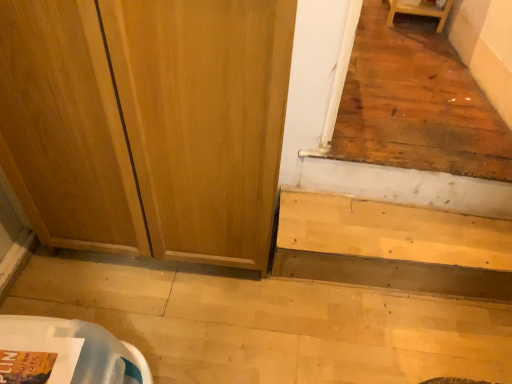
Describe the element at coordinates (392, 246) in the screenshot. I see `light wood/stained stairs at lower right` at that location.

Where is `light wood/stained stairs at lower right`? light wood/stained stairs at lower right is located at coordinates (392, 246).

The height and width of the screenshot is (384, 512). Describe the element at coordinates (204, 119) in the screenshot. I see `wooden screen door at center` at that location.

This screenshot has height=384, width=512. In order to click on wooden screen door at center in this screenshot , I will do `click(204, 119)`.

Image resolution: width=512 pixels, height=384 pixels. In order to click on light wood/stained stairs at lower right in this screenshot , I will do 392,246.

Considering the positions of objects wooden screen door at center and light wood/stained stairs at lower right in the image provided, who is more to the left, wooden screen door at center or light wood/stained stairs at lower right?

Positioned to the left is wooden screen door at center.

Considering the positions of objects wooden screen door at center and light wood/stained stairs at lower right in the image provided, who is in front, wooden screen door at center or light wood/stained stairs at lower right?

wooden screen door at center.

Is point (181, 8) positioned behind point (333, 202)?

No.

Consider the image. From the image's perspective, would you say wooden screen door at center is shown under light wood/stained stairs at lower right?

Incorrect, from the image's perspective, wooden screen door at center is higher than light wood/stained stairs at lower right.

From a real-world perspective, is wooden screen door at center above or below light wood/stained stairs at lower right?

In terms of real-world spatial position, wooden screen door at center is above light wood/stained stairs at lower right.

Consider the image. Is wooden screen door at center thinner than light wood/stained stairs at lower right?

In fact, wooden screen door at center might be wider than light wood/stained stairs at lower right.

In terms of height, does wooden screen door at center look taller or shorter compared to light wood/stained stairs at lower right?

wooden screen door at center is taller than light wood/stained stairs at lower right.

Considering the sizes of wooden screen door at center and light wood/stained stairs at lower right in the image, is wooden screen door at center bigger or smaller than light wood/stained stairs at lower right?

wooden screen door at center is bigger than light wood/stained stairs at lower right.

Is wooden screen door at center not within light wood/stained stairs at lower right?

Yes, wooden screen door at center is outside of light wood/stained stairs at lower right.

Is wooden screen door at center next to light wood/stained stairs at lower right and touching it?

No, wooden screen door at center is not in contact with light wood/stained stairs at lower right.

Is wooden screen door at center positioned with its back to light wood/stained stairs at lower right?

No, wooden screen door at center's orientation is not away from light wood/stained stairs at lower right.

Where is `screen door located on the left of light wood/stained stairs at lower right`? screen door located on the left of light wood/stained stairs at lower right is located at coordinates (204, 119).

Which is more to the left, light wood/stained stairs at lower right or wooden screen door at center?

wooden screen door at center is more to the left.

Considering the positions of objects light wood/stained stairs at lower right and wooden screen door at center in the image provided, who is behind, light wood/stained stairs at lower right or wooden screen door at center?

light wood/stained stairs at lower right is further away from the camera.

Is point (302, 247) closer or farther from the camera than point (202, 94)?

Point (302, 247) is positioned farther from the camera compared to point (202, 94).

From the image's perspective, is light wood/stained stairs at lower right located above or below wooden screen door at center?

light wood/stained stairs at lower right is below wooden screen door at center.

From a real-world perspective, is light wood/stained stairs at lower right below wooden screen door at center?

Indeed, from a real-world perspective, light wood/stained stairs at lower right is positioned beneath wooden screen door at center.

Is light wood/stained stairs at lower right wider or thinner than wooden screen door at center?

In the image, light wood/stained stairs at lower right appears to be more narrow than wooden screen door at center.

Considering the sizes of objects light wood/stained stairs at lower right and wooden screen door at center in the image provided, who is taller, light wood/stained stairs at lower right or wooden screen door at center?

Standing taller between the two is wooden screen door at center.

Does light wood/stained stairs at lower right have a smaller size compared to wooden screen door at center?

Yes.

Is light wood/stained stairs at lower right situated inside wooden screen door at center or outside?

light wood/stained stairs at lower right exists outside the volume of wooden screen door at center.

Is light wood/stained stairs at lower right not near wooden screen door at center?

They are positioned close to each other.

Is light wood/stained stairs at lower right facing away from wooden screen door at center?

light wood/stained stairs at lower right is not turned away from wooden screen door at center.

Find the location of a particular element. Image resolution: width=512 pixels, height=384 pixels. stairwell on the right of wooden screen door at center is located at coordinates (392, 246).

Image resolution: width=512 pixels, height=384 pixels. In order to click on stairwell located underneath the wooden screen door at center (from a real-world perspective) in this screenshot , I will do `click(392, 246)`.

The image size is (512, 384). What are the coordinates of `screen door in front of the light wood/stained stairs at lower right` in the screenshot? It's located at click(x=204, y=119).